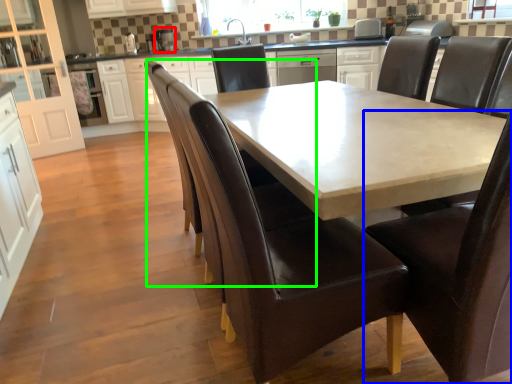
Question: Which object is positioned farthest from appliance (highlighted by a red box)? Select from chair (highlighted by a blue box) and armchair (highlighted by a green box).

Choices:
 (A) chair
 (B) armchair

Answer: (A)